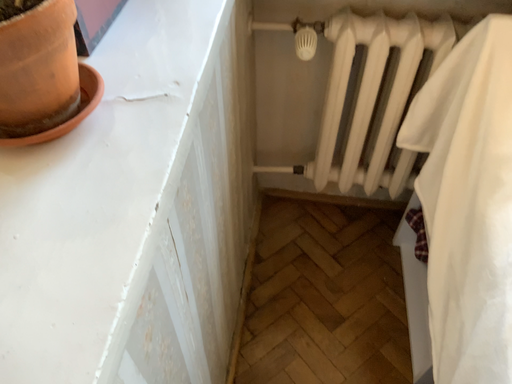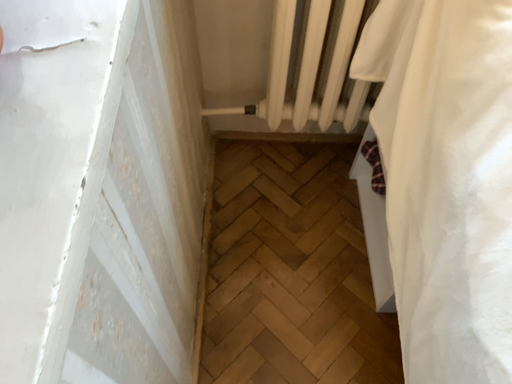
Question: How did the camera likely rotate when shooting the video?

Choices:
 (A) rotated upward
 (B) rotated downward

Answer: (B)